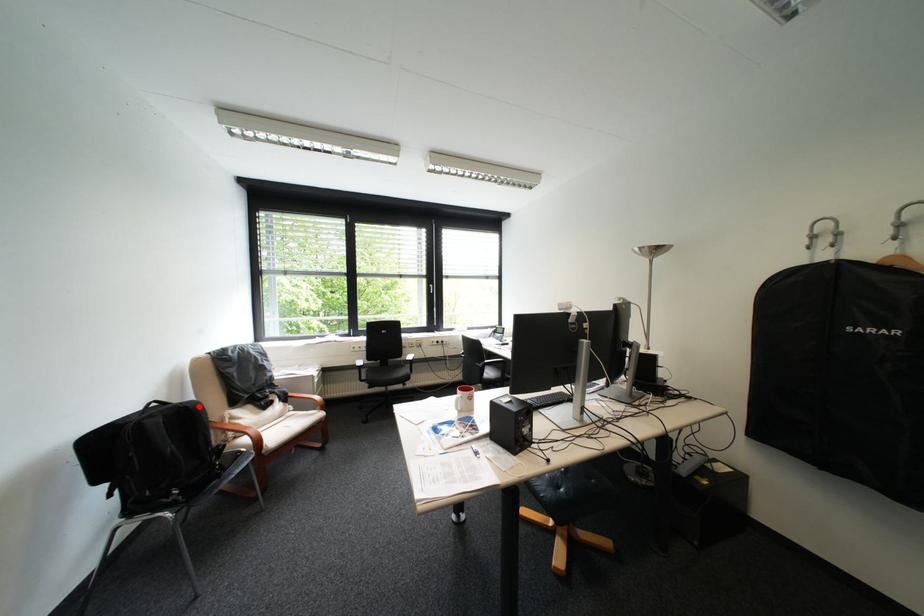
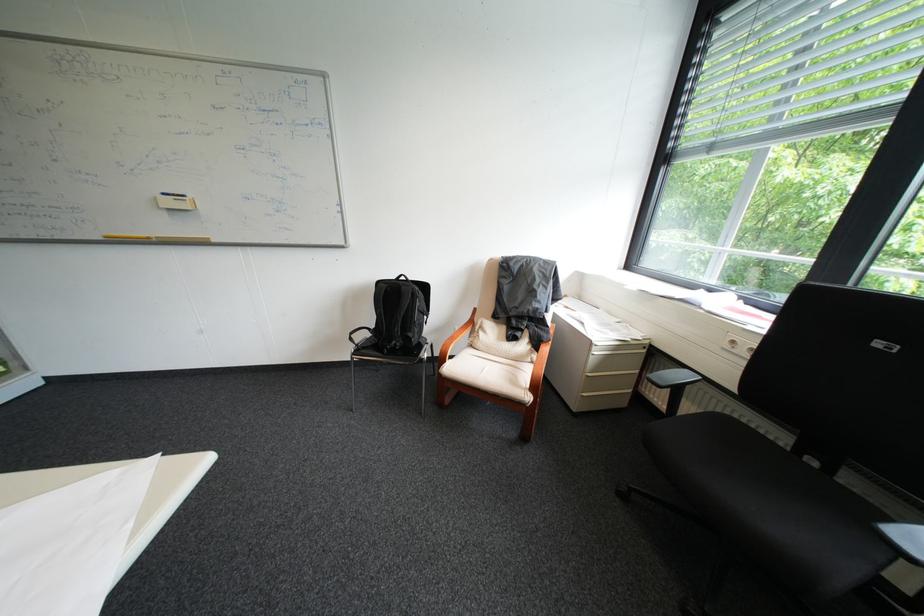
Find the pixel in the second image that matches the highlighted location in the first image.

(415, 288)